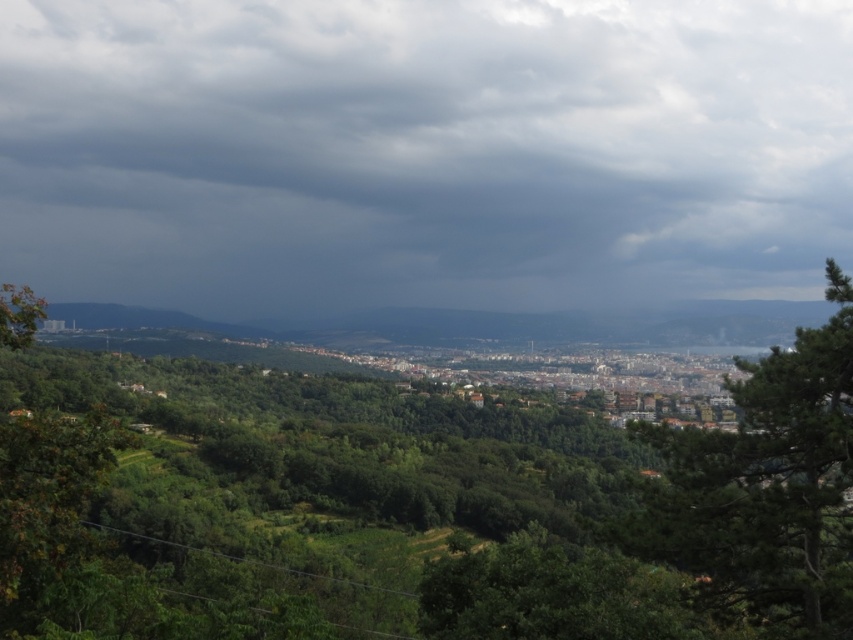
Is point (846, 396) less distant than point (767, 557)?

No, (846, 396) is behind (767, 557).

Is point (242, 592) positioned after point (663, 477)?

Yes.

This screenshot has height=640, width=853. What are the coordinates of `green leafy tree at center` in the screenshot? It's located at (413, 502).

Between dark gray cloud at upper center and green leafy tree at center-right, which one has less height?

green leafy tree at center-right

Does dark gray cloud at upper center have a smaller size compared to green leafy tree at center-right?

Actually, dark gray cloud at upper center might be larger than green leafy tree at center-right.

Between point (606, 228) and point (680, 561), which one is positioned behind?

Point (606, 228)

This screenshot has height=640, width=853. I want to click on dark gray cloud at upper center, so click(x=422, y=154).

Describe the element at coordinates (422, 154) in the screenshot. I see `dark gray cloud at upper center` at that location.

Between dark gray cloud at upper center and green leafy tree at center, which one has more height?

With more height is dark gray cloud at upper center.

Identify the location of dark gray cloud at upper center. The width and height of the screenshot is (853, 640). (422, 154).

You are a GUI agent. You are given a task and a screenshot of the screen. Output one action in this format:
    pyautogui.click(x=<x>, y=<y>)
    Task: Click on the dark gray cloud at upper center
    
    Given the screenshot: What is the action you would take?
    422,154